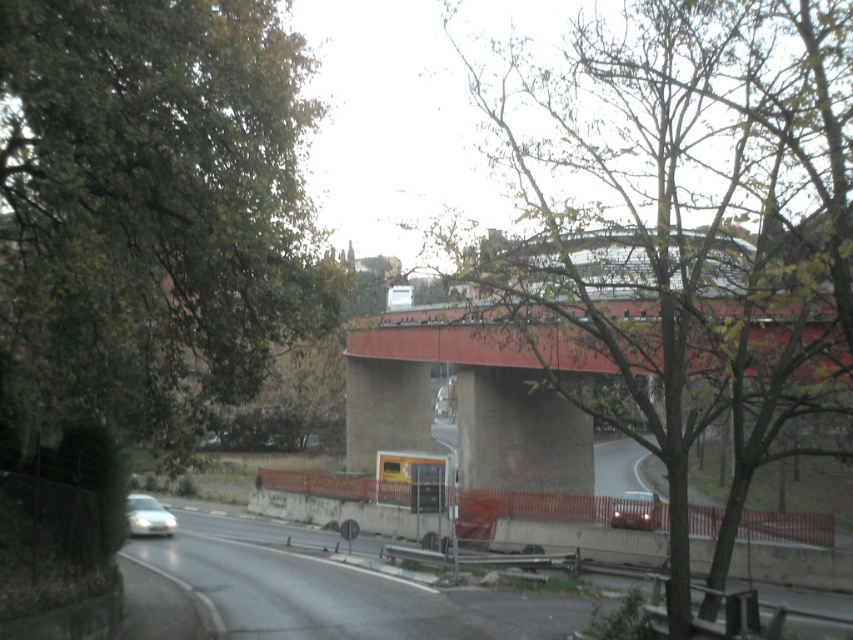
You are a pedestrian standing at the edge of the curved road and want to cross to the other side. There is a green leafy tree at center and a shiny silver car at center in your view. Which object is closer to you as you decide where to cross safely?

The green leafy tree at center is closer to the viewer than the shiny silver car at center, so you should pay attention to the proximity of the green leafy tree at center when deciding where to cross safely.

You are driving along the gray concrete highway at lower left and want to park near the green leafy tree at center. Based on the scene, can you determine which direction you should turn to reach the tree?

The green leafy tree at center is positioned on the right side of the gray concrete highway at lower left, so you should turn right to reach the tree.

You are a pedestrian standing at the edge of the curved road. You see a green leafy tree at center and a shiny silver car at center. Which object is higher in the image?

The green leafy tree at center is located above the shiny silver car at center, so the green leafy tree at center is higher in the image.